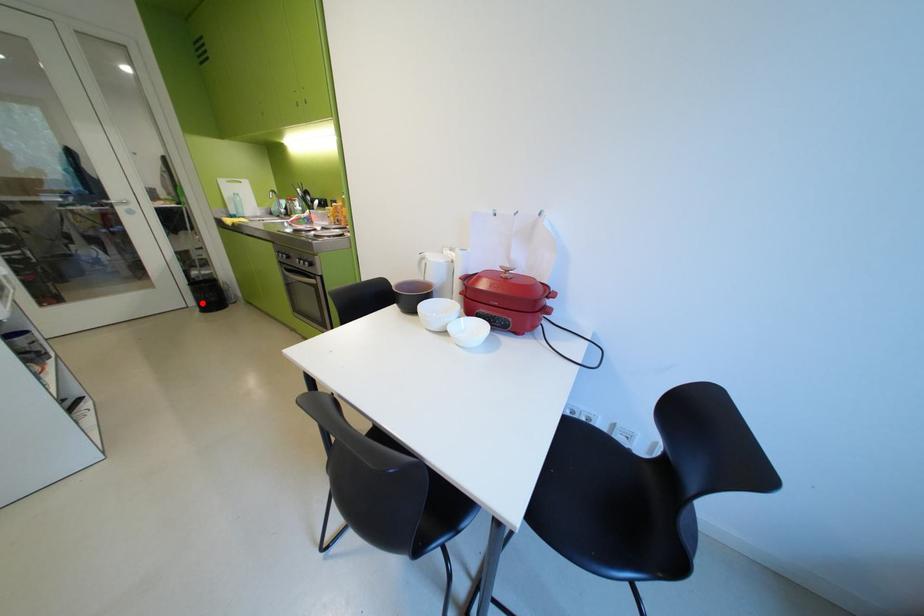
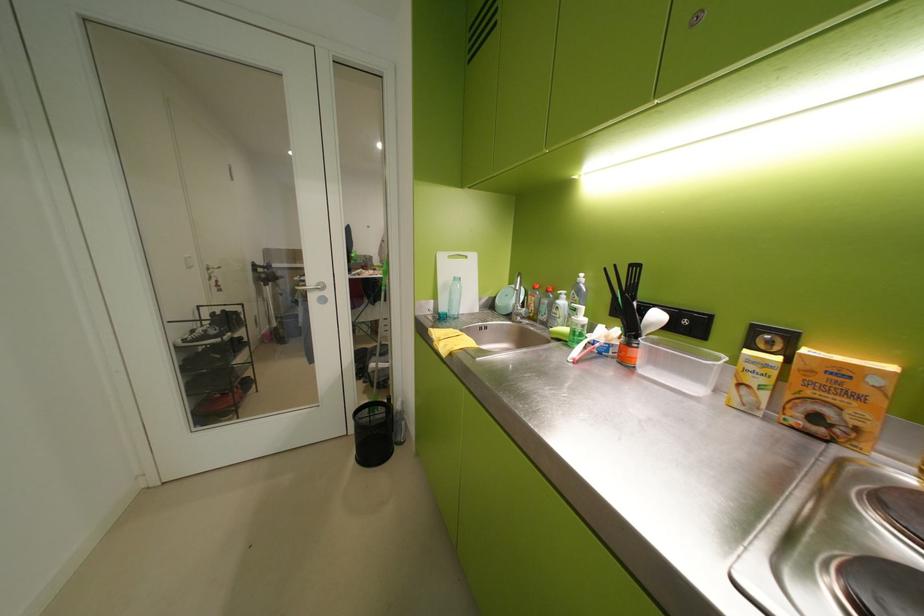
Question: I am providing you with two images of the same scene from different viewpoints. A red point is shown in image1. For the corresponding object point in image2, is it positioned nearer or farther from the camera?

Choices:
 (A) Nearer
 (B) Farther

Answer: (B)